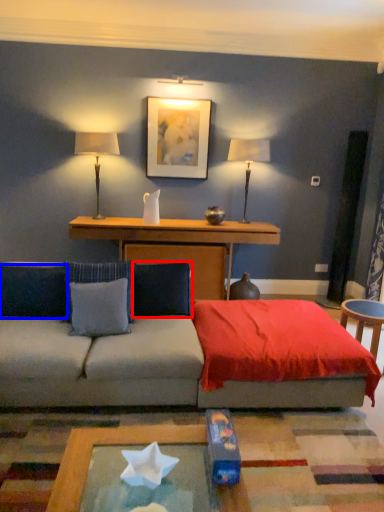
Question: Which object appears closest to the camera in this image, pillow (highlighted by a red box) or pillow (highlighted by a blue box)?

Choices:
 (A) pillow
 (B) pillow

Answer: (B)